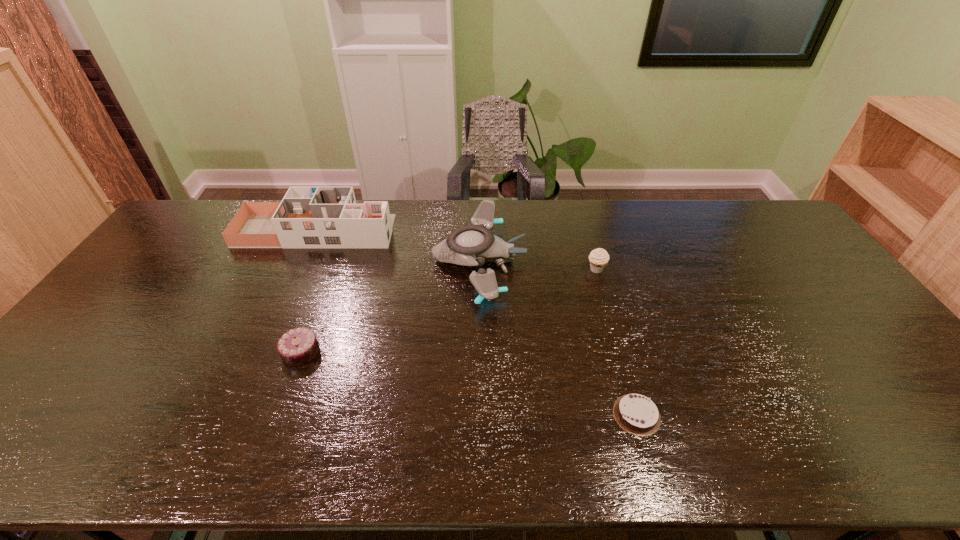
Where is `free point between the fourth shortest object and the shortest object`? The width and height of the screenshot is (960, 540). free point between the fourth shortest object and the shortest object is located at coordinates (558, 338).

Where is `vacant area between the second nearest object and the fourth shortest object`? vacant area between the second nearest object and the fourth shortest object is located at coordinates [x=390, y=306].

Find the location of `vacant area that lies between the farther chocolate cake and the second tallest object`. vacant area that lies between the farther chocolate cake and the second tallest object is located at coordinates (390, 306).

This screenshot has width=960, height=540. In order to click on vacant area that lies between the right chocolate cake and the second nearest object in this screenshot , I will do `click(468, 383)`.

Find the location of `unoccupied position between the shorter chocolate cake and the tallest object`. unoccupied position between the shorter chocolate cake and the tallest object is located at coordinates (476, 323).

Locate an element on the screen. The height and width of the screenshot is (540, 960). vacant area that lies between the third tallest object and the shortest object is located at coordinates (616, 342).

The width and height of the screenshot is (960, 540). Identify the location of free space that is in between the taller chocolate cake and the dollhouse. (308, 292).

Find the location of `free space between the right chocolate cake and the dollhouse`. free space between the right chocolate cake and the dollhouse is located at coordinates point(476,323).

This screenshot has height=540, width=960. In order to click on free space between the tallest object and the left chocolate cake in this screenshot , I will do `click(308, 292)`.

Where is `empty space between the fourth farthest object and the third tallest object`? empty space between the fourth farthest object and the third tallest object is located at coordinates (448, 310).